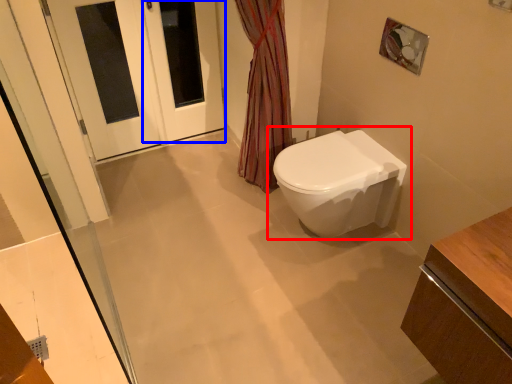
Question: Which of the following is the farthest to the observer, toilet (highlighted by a red box) or screen door (highlighted by a blue box)?

Choices:
 (A) toilet
 (B) screen door

Answer: (B)